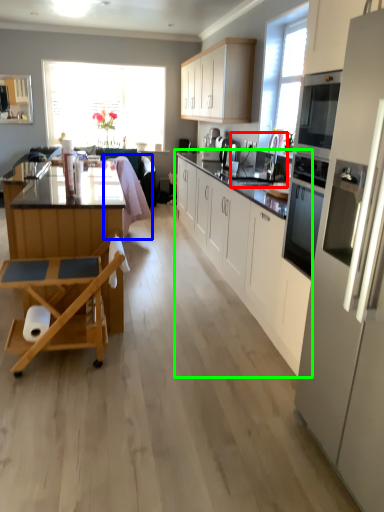
Question: Estimate the real-world distances between objects in this image. Which object is farther from sink (highlighted by a red box), swivel chair (highlighted by a blue box) or cabinetry (highlighted by a green box)?

Choices:
 (A) swivel chair
 (B) cabinetry

Answer: (A)